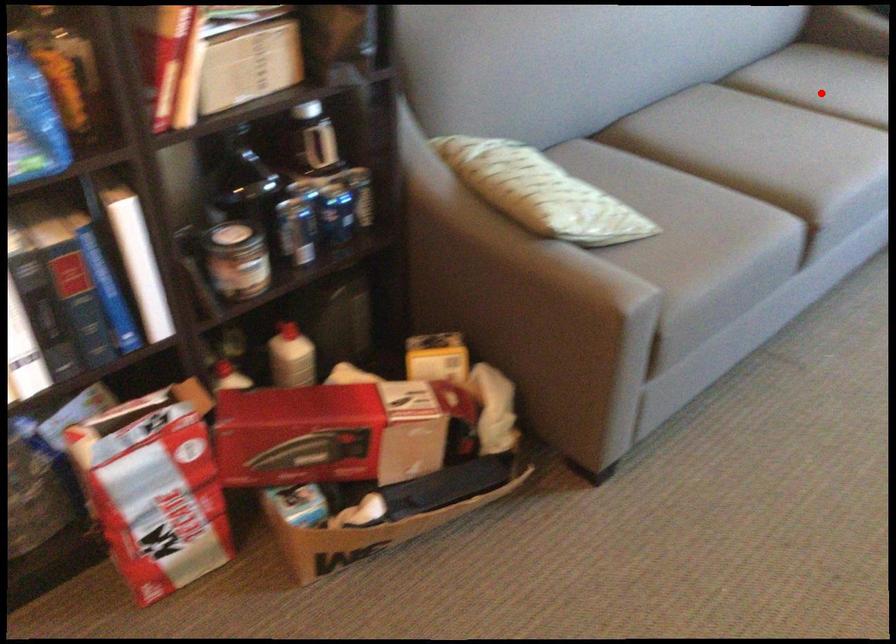
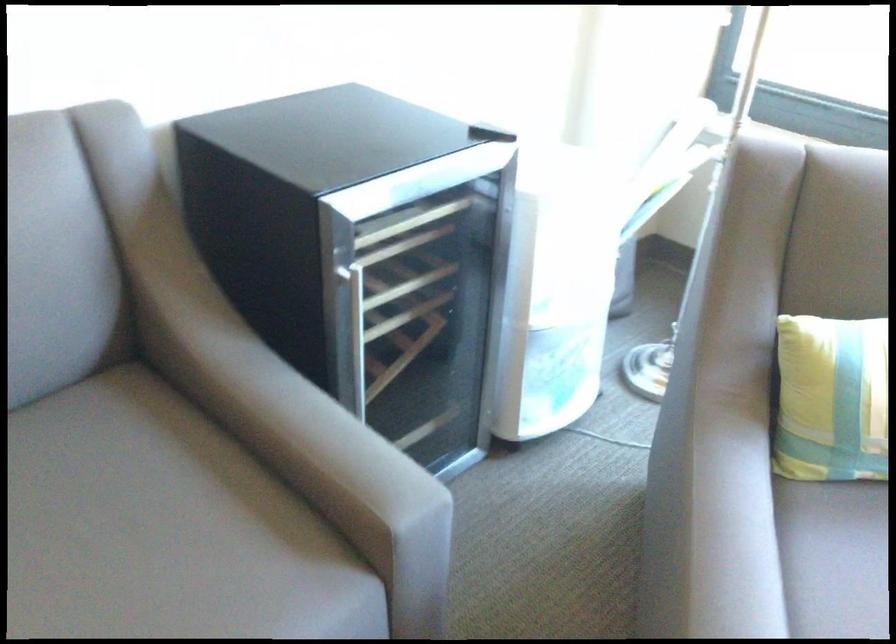
Question: I am providing you with two images of the same scene from different viewpoints. A red point is marked on the first image. At the location where the point appears in image 1, is it still visible in image 2?

Choices:
 (A) Yes
 (B) No

Answer: (A)